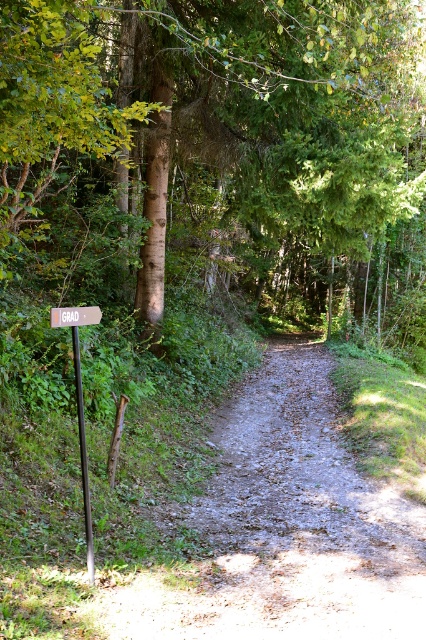
You are a hiker who wants to follow the trail marked by the orange wooden signpost at left and the wooden sign at center. Which one should you look at first to determine your direction?

You should look at the orange wooden signpost at left first because it is larger in size than the wooden sign at center, making it more prominent and easier to notice from a distance.

You are standing on the forest path and see both the orange wooden signpost at left and the brown rough wooden post at left. Which one is nearer to you?

The orange wooden signpost at left is closer to the viewer than the brown rough wooden post at left, so the orange wooden signpost at left is nearer to you.

You are a hiker walking along the forest path and see both the orange wooden signpost at left and the brown rough wooden post at left. Which one is higher up in the air?

The orange wooden signpost at left is above the brown rough wooden post at left, so it is higher up in the air.